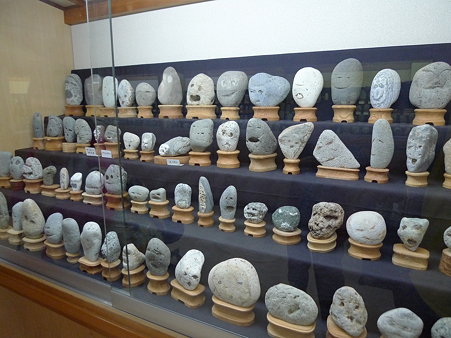
I want to click on dispaly case, so click(251, 23), click(111, 211).